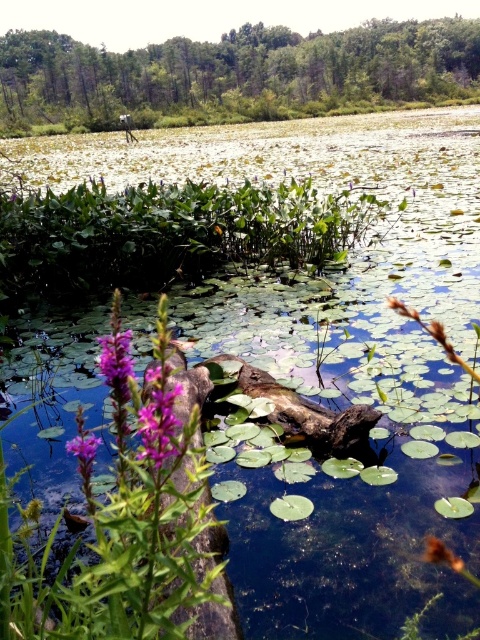
You are planning to install a small wooden bridge connecting the two farthest points in the pond. The bridge needs to be at least 120 feet long to span the distance between the green leafy tree at upper center and the purple matte flower at lower left. Is the bridge long enough?

Result: The distance between the green leafy tree at upper center and the purple matte flower at lower left is 111.32 feet. Since the bridge needs to be at least 120 feet long, it is not long enough to span the required distance.

You are standing at the point marked as point (157, 416) in the image. What do you see directly in front of you?

You see the purple matte flower at center left directly in front of you at point (157, 416).